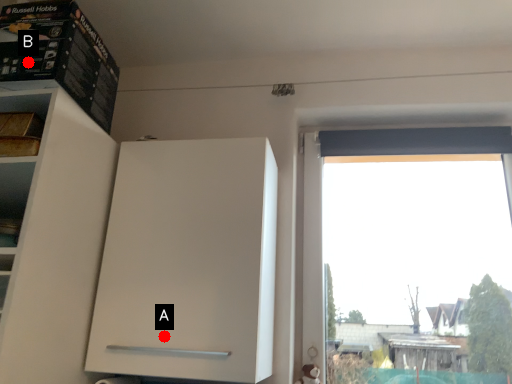
Question: Two points are circled on the image, labeled by A and B beside each circle. Which point is further to the camera?

Choices:
 (A) A is further
 (B) B is further

Answer: (A)